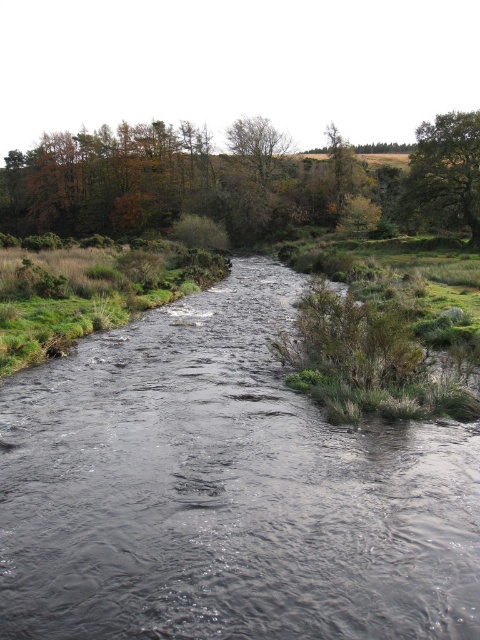
Question: Is green leafy tree at upper right further to camera compared to green leafy tree at upper center?

Choices:
 (A) no
 (B) yes

Answer: (A)

Question: Does green leafy tree at upper right have a smaller size compared to green leafy tree at upper center?

Choices:
 (A) yes
 (B) no

Answer: (A)

Question: Does black water at center lie behind green leafy tree at upper right?

Choices:
 (A) no
 (B) yes

Answer: (A)

Question: Which object is positioned farthest from the green leafy tree at upper right?

Choices:
 (A) black water at center
 (B) green leafy tree at upper center

Answer: (A)

Question: Considering the real-world distances, which object is farthest from the green leafy tree at upper right?

Choices:
 (A) green leafy tree at upper center
 (B) black water at center

Answer: (B)

Question: Which point is farther to the camera?

Choices:
 (A) (x=450, y=140)
 (B) (x=71, y=614)

Answer: (A)